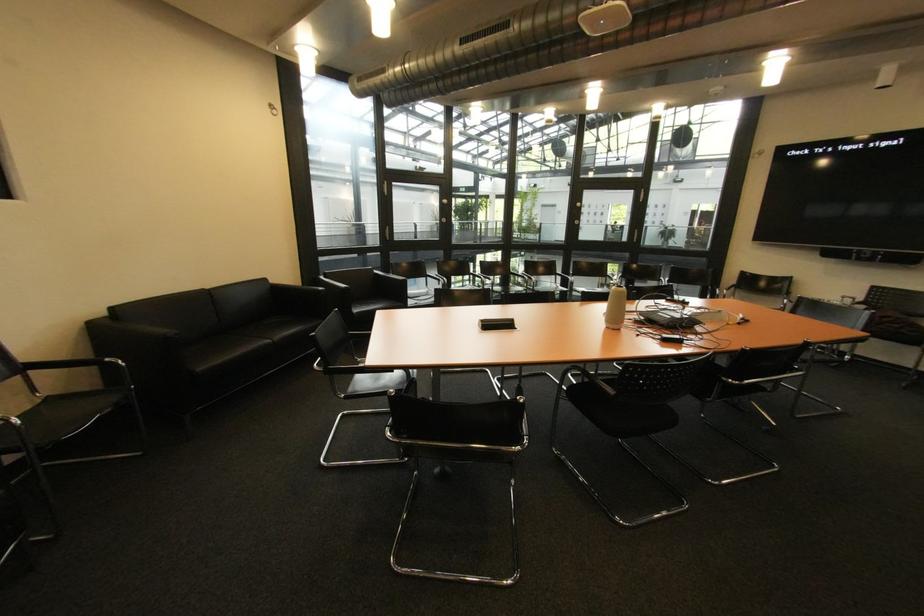
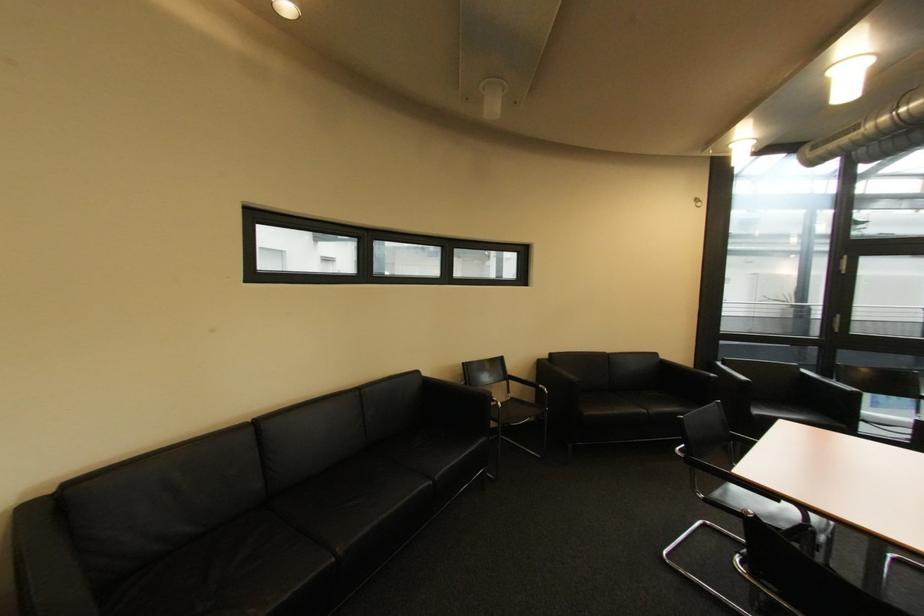
Where in the second image is the point corresponding to (323,367) from the first image?

(686, 450)